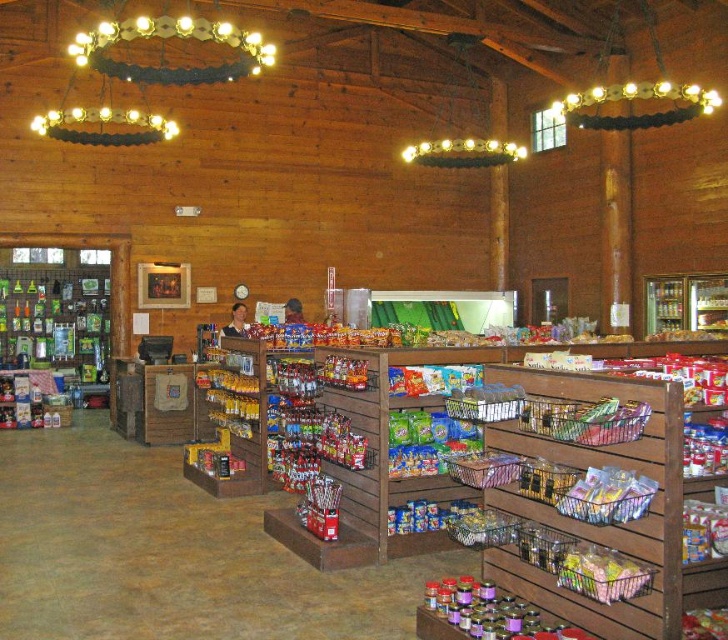
Is point (716, 534) in front of point (360, 381)?

Yes, it is in front of point (360, 381).

From the picture: Is shiny metallic can at lower right positioned in front of shiny plastic candy at center?

That is True.

Between point (719, 534) and point (347, 387), which one is positioned behind?

The point (347, 387) is more distant.

This screenshot has width=728, height=640. What are the coordinates of `shiny metallic can at lower right` in the screenshot? It's located at (703, 531).

Does metallic wire basket at center lie behind shiny metallic snack at right?

Yes, it is.

Does point (641, 426) come behind point (711, 440)?

No, it is not.

The height and width of the screenshot is (640, 728). I want to click on metallic wire basket at center, so click(585, 420).

Does gold metallic chandelier at upper center appear over shiny metallic can at lower right?

Yes.

What do you see at coordinates (170, 36) in the screenshot?
I see `gold metallic chandelier at upper center` at bounding box center [170, 36].

Where is `gold metallic chandelier at upper center`? gold metallic chandelier at upper center is located at coordinates (170, 36).